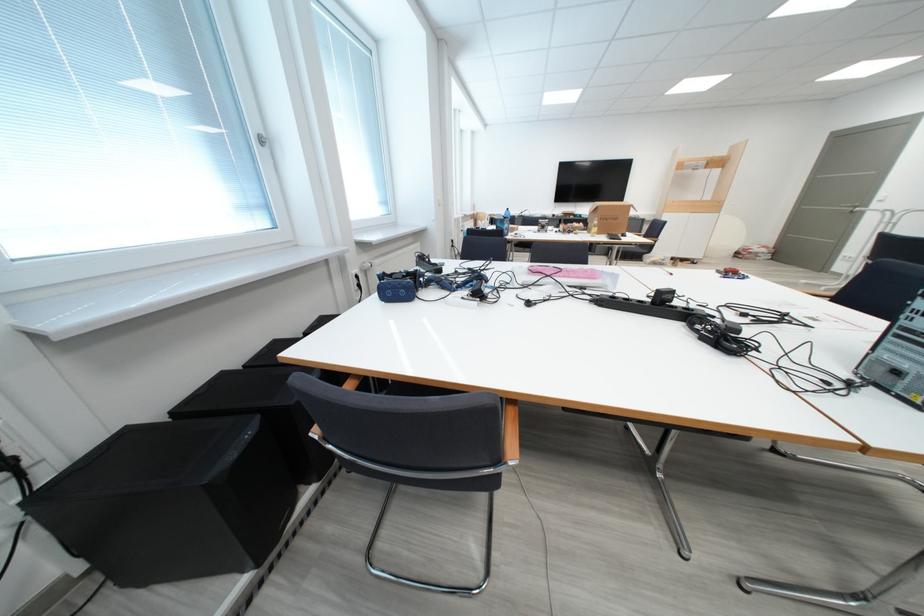
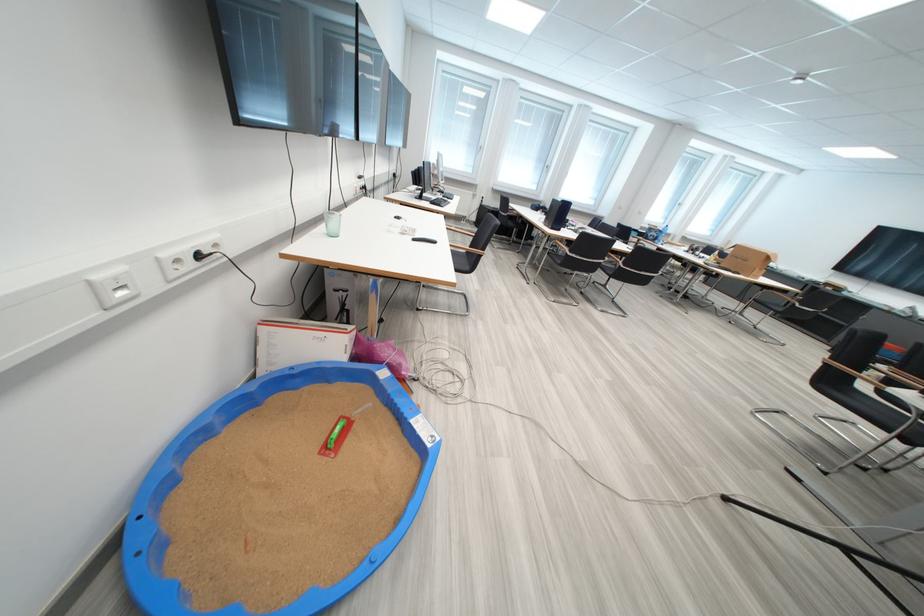
In the second image, find the point that corresponds to (634,237) in the first image.

(746, 275)